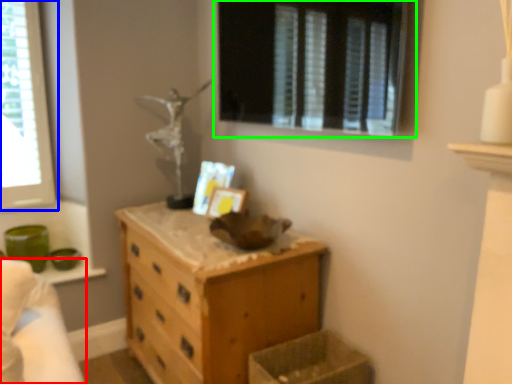
Question: Which object is positioned farthest from bed (highlighted by a red box)? Select from window (highlighted by a blue box) and window (highlighted by a green box).

Choices:
 (A) window
 (B) window

Answer: (B)